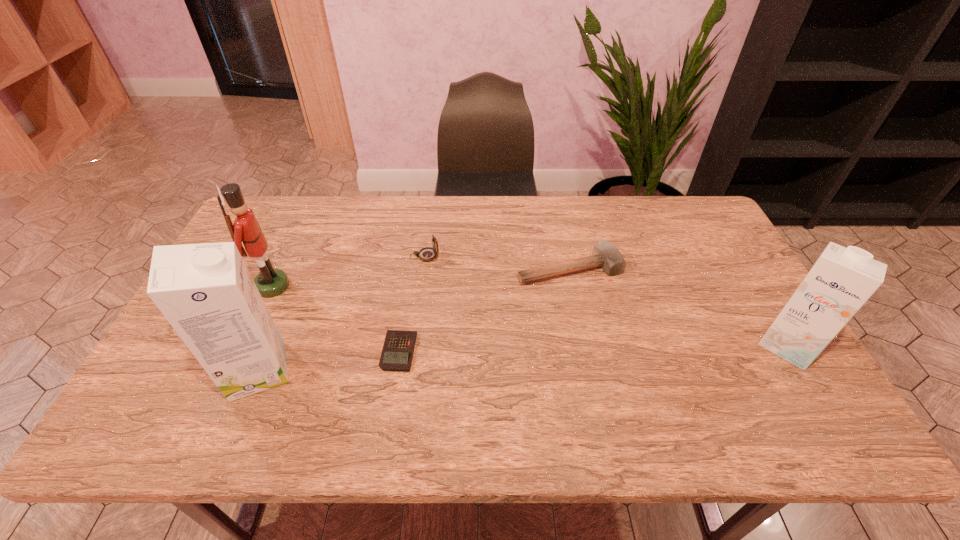
Locate an element on the screen. The width and height of the screenshot is (960, 540). free region located 0.370m on the face of the compass is located at coordinates (558, 256).

Find the location of a particular element. The height and width of the screenshot is (540, 960). vacant space located on the front of the mallet is located at coordinates (578, 314).

You are a GUI agent. You are given a task and a screenshot of the screen. Output one action in this format:
    pyautogui.click(x=<x>, y=<y>)
    Task: Click on the free space located 0.110m on the right of the shortest object
    The height and width of the screenshot is (540, 960).
    Given the screenshot: What is the action you would take?
    pyautogui.click(x=459, y=352)

Locate an element on the screen. vacant region located 0.310m on the front-facing side of the nutcracker is located at coordinates (396, 286).

The width and height of the screenshot is (960, 540). What are the coordinates of `calculator situated at the near edge` in the screenshot? It's located at (397, 353).

The image size is (960, 540). I want to click on carton that is at the left edge, so click(205, 291).

This screenshot has height=540, width=960. I want to click on nutcracker positioned at the left edge, so click(x=270, y=282).

You are a GUI agent. You are given a task and a screenshot of the screen. Output one action in this format:
    pyautogui.click(x=<x>, y=<y>)
    Task: Click on the object located at the right edge
    This screenshot has height=540, width=960.
    Given the screenshot: What is the action you would take?
    pyautogui.click(x=840, y=282)

This screenshot has width=960, height=540. Identify the location of object that is at the near left corner. (205, 291).

This screenshot has height=540, width=960. What are the coordinates of `object present at the near right corner` in the screenshot? It's located at [840, 282].